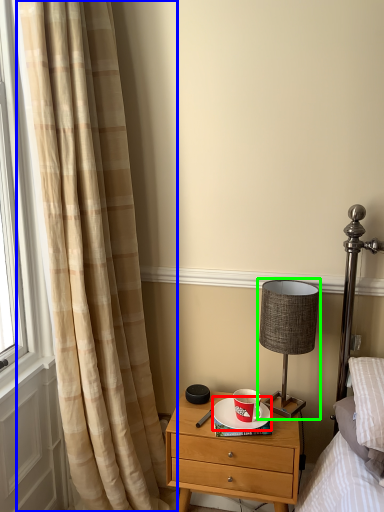
Question: Which object is positioned closest to saucer (highlighted by a red box)? Select from curtain (highlighted by a blue box) and table lamp (highlighted by a green box).

Choices:
 (A) curtain
 (B) table lamp

Answer: (B)